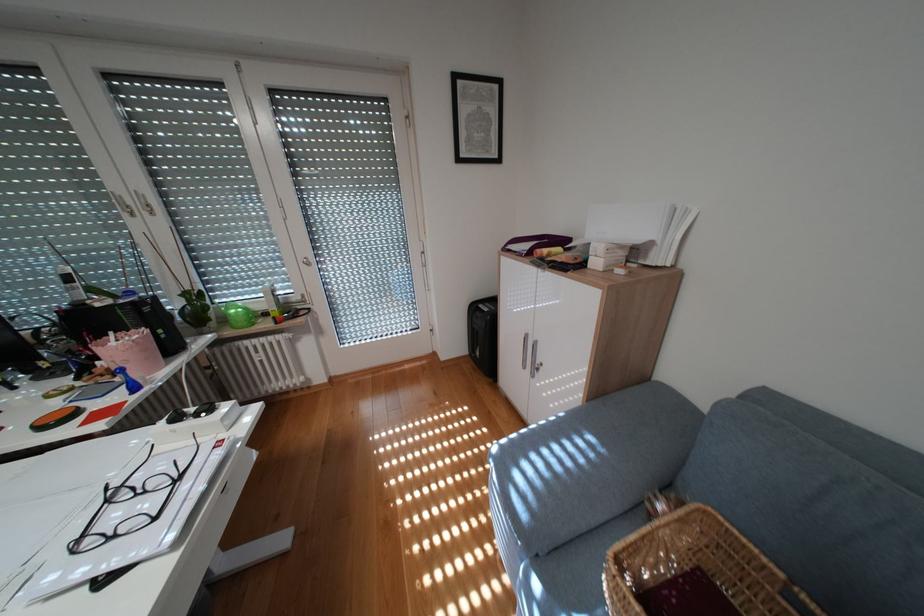
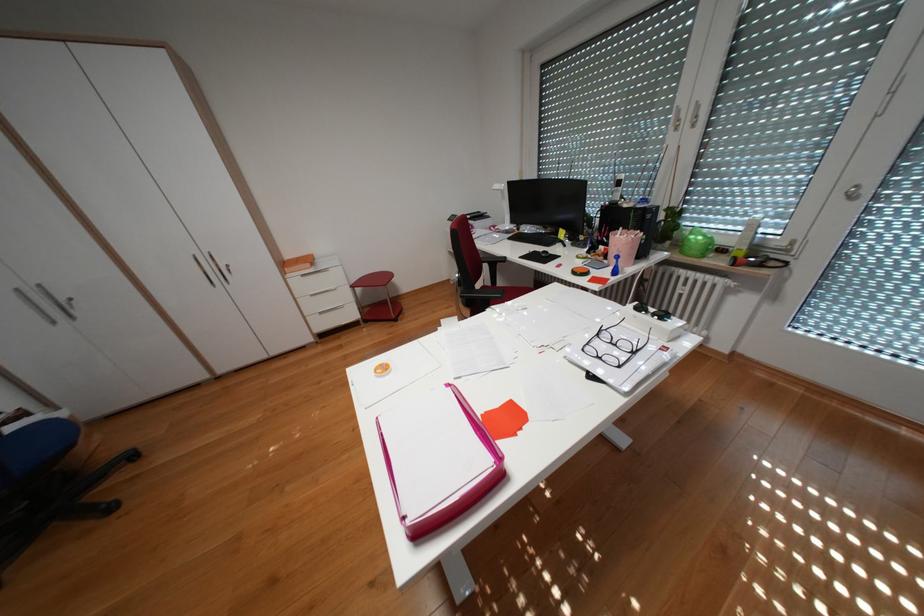
Locate, in the second image, the point that corresponds to [117,196] in the first image.

(682, 111)